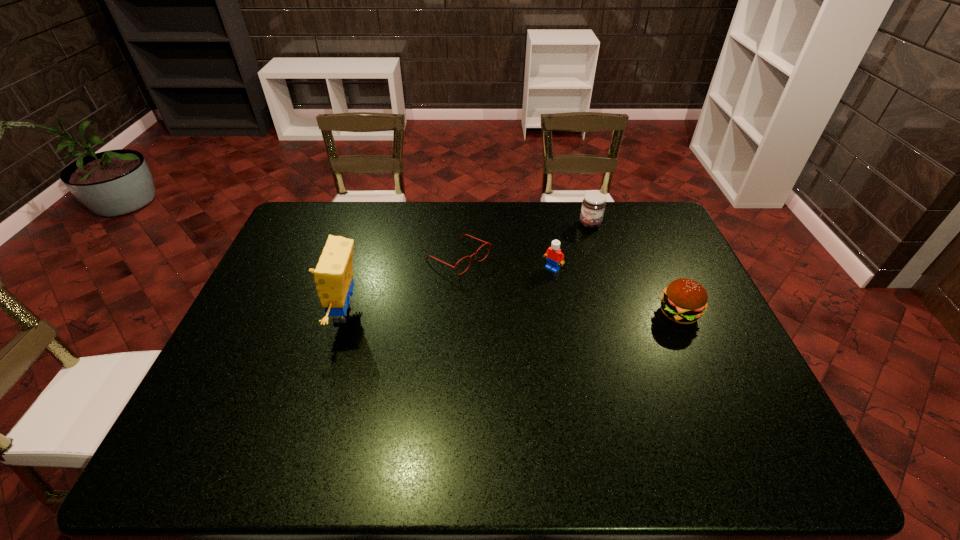
Image resolution: width=960 pixels, height=540 pixels. What are the coordinates of `free spot that satisfies the following two spatial constraints: 1. on the front side of the spectacles; 2. on the right side of the hamburger` in the screenshot? It's located at (455, 314).